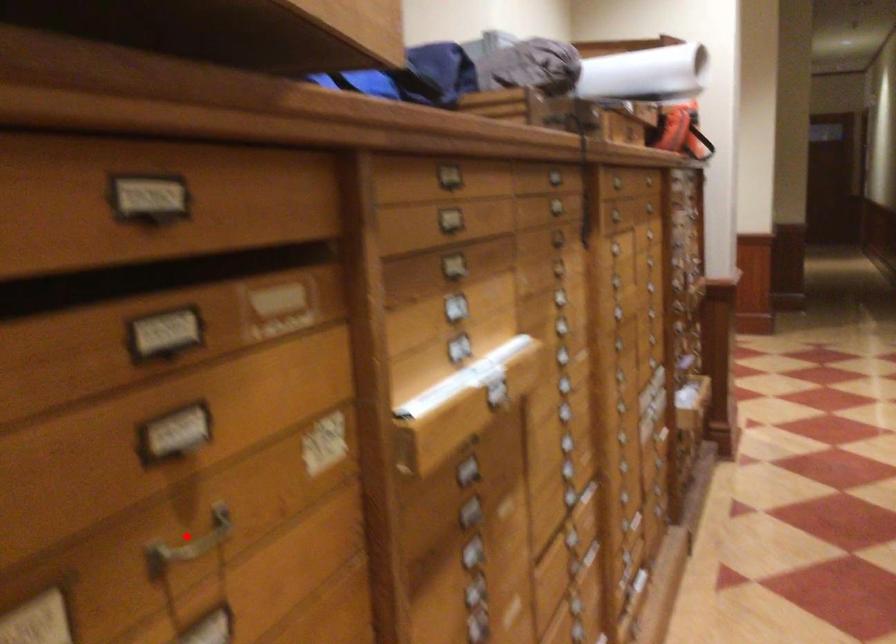
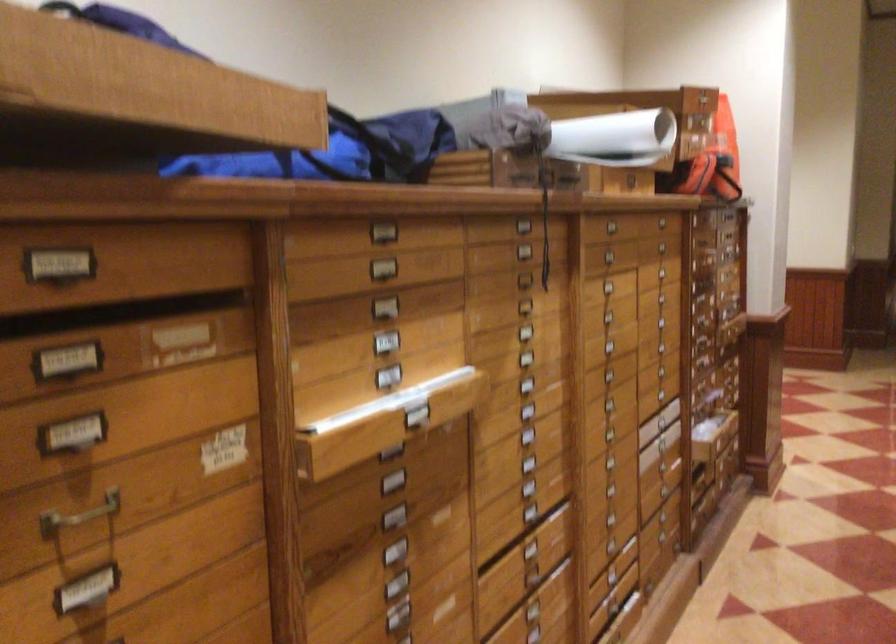
Question: I am providing you with two images of the same scene from different viewpoints. In image1, a red point is highlighted. Considering the same 3D point in image2, which of the following is correct?

Choices:
 (A) It is closer
 (B) It is farther

Answer: (B)